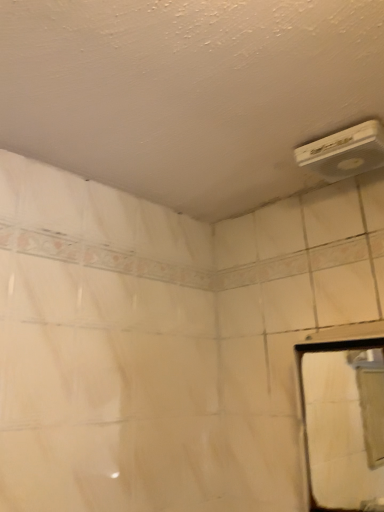
Question: From a real-world perspective, is white glossy mirror at right above or below white plastic air conditioning unit at upper right?

Choices:
 (A) below
 (B) above

Answer: (A)

Question: From the image's perspective, is white glossy mirror at right positioned above or below white plastic air conditioning unit at upper right?

Choices:
 (A) below
 (B) above

Answer: (A)

Question: Considering the positions of point (352, 401) and point (306, 146), is point (352, 401) closer or farther from the camera than point (306, 146)?

Choices:
 (A) farther
 (B) closer

Answer: (A)

Question: Is point (347, 133) positioned closer to the camera than point (327, 504)?

Choices:
 (A) closer
 (B) farther

Answer: (A)

Question: Would you say white plastic air conditioning unit at upper right is to the left or to the right of white glossy mirror at right in the picture?

Choices:
 (A) left
 (B) right

Answer: (A)

Question: Considering the positions of white plastic air conditioning unit at upper right and white glossy mirror at right in the image, is white plastic air conditioning unit at upper right taller or shorter than white glossy mirror at right?

Choices:
 (A) short
 (B) tall

Answer: (A)

Question: Is white plastic air conditioning unit at upper right in front of or behind white glossy mirror at right in the image?

Choices:
 (A) behind
 (B) front

Answer: (A)